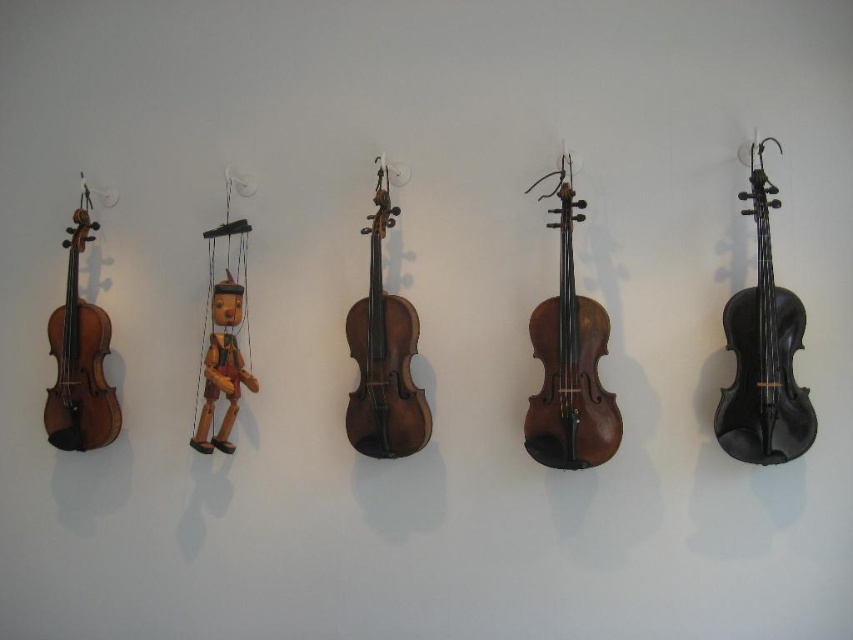
Question: Estimate the real-world distances between objects in this image. Which object is closer to the dark brown wood cello at center?

Choices:
 (A) matte brown violin at left
 (B) wooden puppet at center

Answer: (B)

Question: Which object appears farthest from the camera in this image?

Choices:
 (A) matte brown violin at left
 (B) dark brown wood cello at center
 (C) wooden puppet at center
 (D) black matte cello at right

Answer: (A)

Question: Can you confirm if wooden violin at center is positioned below matte brown violin at left?

Choices:
 (A) yes
 (B) no

Answer: (B)

Question: Which of the following is the closest to the observer?

Choices:
 (A) wooden violin at center
 (B) dark brown wood cello at center
 (C) black matte cello at right
 (D) matte brown violin at left

Answer: (C)

Question: Can you confirm if black matte cello at right is smaller than matte brown violin at left?

Choices:
 (A) yes
 (B) no

Answer: (B)

Question: Observing the image, what is the correct spatial positioning of dark brown wood cello at center in reference to matte brown violin at left?

Choices:
 (A) left
 (B) right

Answer: (B)